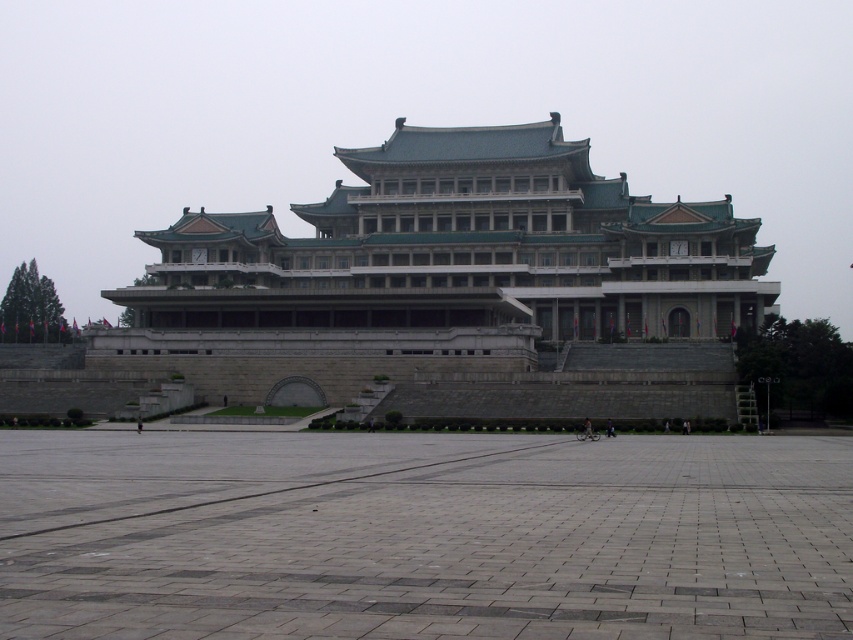
You are standing at the base of the gray stone palace at center and want to reach the gray concrete plaza at center. Based on the scene description, which direction should you go to move from the palace to the plaza?

The gray concrete plaza at center is shorter than the gray stone palace at center, so you should go downward to move from the palace to the plaza.

You are planning to host a large event and need to determine the best location for setting up temporary tents. Given the image, which area would allow for more tent placements between the gray concrete plaza at center and the gray stone palace at center?

The gray stone palace at center occupies more space than the gray concrete plaza at center, so the gray stone palace at center would allow for more tent placements.

You are standing in front of the gray stone palace at center and want to walk to the gray concrete plaza at center. Which direction should you move relative to the palace?

The gray concrete plaza at center is to the left of the gray stone palace at center, so you should move to the left relative to the palace.